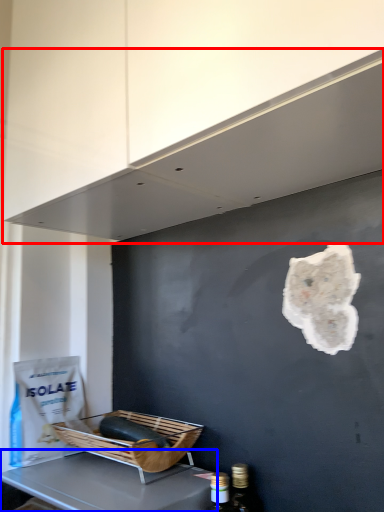
Question: Which of the following is the closest to the observer, exhaust hood (highlighted by a red box) or furniture (highlighted by a blue box)?

Choices:
 (A) exhaust hood
 (B) furniture

Answer: (A)